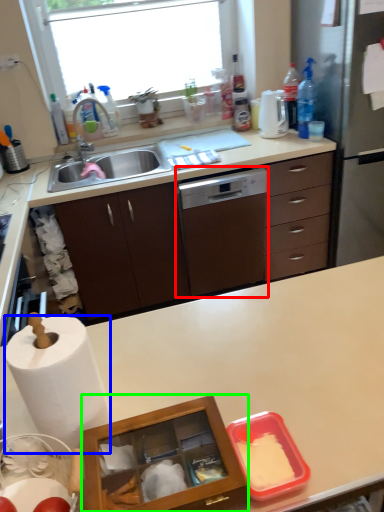
Question: Based on their relative distances, which object is farther from home appliance (highlighted by a red box)? Choose from paper towel (highlighted by a blue box) and crate (highlighted by a green box).

Choices:
 (A) paper towel
 (B) crate

Answer: (B)